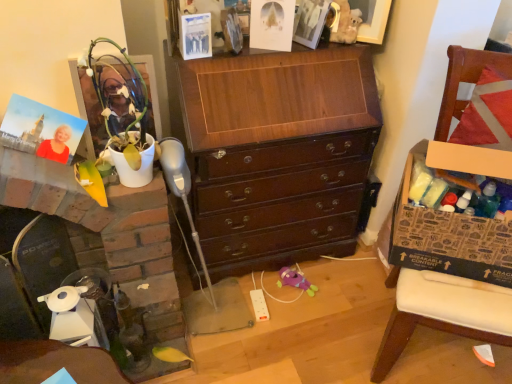
What do you see at coordinates (310, 22) in the screenshot?
I see `matte white picture frame at upper center, placed as the second picture frame when sorted from bottom to top` at bounding box center [310, 22].

Locate an element on the screen. matte plastic picture frame at upper left, which is the 2th picture frame from right to left is located at coordinates (151, 88).

In order to face matte plastic picture frame at upper left, the second picture frame viewed from the top, should I rotate leftwards or rightwards?

Rotate left and turn 17.131 degrees.

This screenshot has height=384, width=512. Find the location of `shiny dark wood chest of drawers at center`. shiny dark wood chest of drawers at center is located at coordinates (276, 152).

Measure the distance between brown wooden chair at right and camera.

A distance of 3.76 feet exists between brown wooden chair at right and camera.

The image size is (512, 384). I want to click on brown cardboard box at right, so click(x=453, y=221).

Based on the photo, which object is closer to the camera, matte white picture frame at upper center, arranged as the 2th picture frame when viewed from the front, or brown wooden chair at right?

brown wooden chair at right is closer to the camera.

Which of these two, matte white picture frame at upper center, placed as the second picture frame when sorted from bottom to top, or brown wooden chair at right, stands taller?

Standing taller between the two is brown wooden chair at right.

From the picture: From the image's perspective, which is above, matte white picture frame at upper center, arranged as the 2th picture frame when viewed from the front, or brown wooden chair at right?

matte white picture frame at upper center, arranged as the 2th picture frame when viewed from the front, from the image's perspective.

Does matte white picture frame at upper center, arranged as the 2th picture frame when viewed from the front, have a lesser height compared to brown cardboard box at right?

Yes.

From the image's perspective, is matte white picture frame at upper center, which is counted as the 1th picture frame, starting from the back, above or below brown cardboard box at right?

Clearly, from the image's perspective, matte white picture frame at upper center, which is counted as the 1th picture frame, starting from the back, is above brown cardboard box at right.

Are matte white picture frame at upper center, which appears as the first picture frame when viewed from the right, and brown cardboard box at right far apart?

matte white picture frame at upper center, which appears as the first picture frame when viewed from the right, is near brown cardboard box at right, not far away.

Which point is more distant from viewer, (295,23) or (478,243)?

Positioned behind is point (295,23).

Which is more to the right, white glossy fireplace at left or brown cardboard box at right?

brown cardboard box at right.

Can you tell me how much white glossy fireplace at left and brown cardboard box at right differ in facing direction?

The facing directions of white glossy fireplace at left and brown cardboard box at right are 33.1 degrees apart.

Is brown cardboard box at right a part of white glossy fireplace at left?

No.

From a real-world perspective, is white glossy fireplace at left over brown cardboard box at right?

No, from a real-world perspective, white glossy fireplace at left is not above brown cardboard box at right.

From a real-world perspective, which object stands above the other?

brown cardboard box at right is physically above.

Can you confirm if brown wooden chair at right is smaller than brown cardboard box at right?

No.

Which of these two, brown wooden chair at right or brown cardboard box at right, stands taller?

Standing taller between the two is brown wooden chair at right.

In the scene shown: Is the depth of shiny dark wood chest of drawers at center greater than that of brown wooden chair at right?

Yes, it is behind brown wooden chair at right.

Which object is positioned more to the left, shiny dark wood chest of drawers at center or brown wooden chair at right?

shiny dark wood chest of drawers at center.

What's the angular difference between shiny dark wood chest of drawers at center and brown wooden chair at right's facing directions?

They differ by 30.6 degrees in their facing directions.

Based on the photo, from the image's perspective, between shiny dark wood chest of drawers at center and brown wooden chair at right, who is located below?

brown wooden chair at right, from the image's perspective.

Where is `fireplace on the left of brown wooden chair at right`? fireplace on the left of brown wooden chair at right is located at coordinates (106, 230).

Is white glossy fireplace at left to the left or to the right of brown wooden chair at right in the image?

From the image, it's evident that white glossy fireplace at left is to the left of brown wooden chair at right.

Relative to brown wooden chair at right, is white glossy fireplace at left in front or behind?

white glossy fireplace at left is positioned farther from the viewer than brown wooden chair at right.

Could you tell me if matte plastic picture frame at upper left, marked as the 1th picture frame in a left-to-right arrangement, is facing brown cardboard box at right?

No, matte plastic picture frame at upper left, marked as the 1th picture frame in a left-to-right arrangement, is not facing towards brown cardboard box at right.

Identify the location of the 1st picture frame behind when counting from the brown cardboard box at right. Image resolution: width=512 pixels, height=384 pixels. (151, 88).

Can brown cardboard box at right be found inside matte plastic picture frame at upper left, which is the 2th picture frame from right to left?

No.

Does matte plastic picture frame at upper left, marked as the first picture frame in a front-to-back arrangement, have a smaller size compared to brown cardboard box at right?

Correct, matte plastic picture frame at upper left, marked as the first picture frame in a front-to-back arrangement, occupies less space than brown cardboard box at right.

I want to click on furniture on the right of matte white picture frame at upper center, placed as the second picture frame when sorted from bottom to top, so click(434, 327).

At what (x,y) coordinates should I click in order to perform the action: click on cabinetry in front of the matte white picture frame at upper center, arranged as the 2th picture frame when viewed from the left. Please return your answer as a coordinate pair (x, y). This screenshot has width=512, height=384. Looking at the image, I should click on (453, 221).

From the picture: Based on their spatial positions, is white glossy fireplace at left or shiny dark wood chest of drawers at center closer to matte white picture frame at upper center, which appears as the first picture frame when viewed from the right?

shiny dark wood chest of drawers at center is positioned closer to the anchor matte white picture frame at upper center, which appears as the first picture frame when viewed from the right.

Which object lies further to the anchor point shiny dark wood chest of drawers at center, matte plastic picture frame at upper left, the second picture frame viewed from the top, or white glossy fireplace at left?

Based on the image, matte plastic picture frame at upper left, the second picture frame viewed from the top, appears to be further to shiny dark wood chest of drawers at center.

Estimate the real-world distances between objects in this image. Which object is closer to white glossy fireplace at left, matte white picture frame at upper center, which appears as the first picture frame when viewed from the right, or matte plastic picture frame at upper left, positioned as the 1th picture frame in bottom-to-top order?

The object closer to white glossy fireplace at left is matte plastic picture frame at upper left, positioned as the 1th picture frame in bottom-to-top order.

Looking at the image, which one is located further to brown cardboard box at right, shiny dark wood chest of drawers at center or matte plastic picture frame at upper left, the second picture frame viewed from the top?

matte plastic picture frame at upper left, the second picture frame viewed from the top.

Considering their positions, is matte plastic picture frame at upper left, positioned as the 1th picture frame in bottom-to-top order, positioned closer to matte white picture frame at upper center, which appears as the first picture frame when viewed from the right, than brown wooden chair at right?

The object closer to matte white picture frame at upper center, which appears as the first picture frame when viewed from the right, is matte plastic picture frame at upper left, positioned as the 1th picture frame in bottom-to-top order.

From the image, which object appears to be farther from white glossy fireplace at left, brown wooden chair at right or matte plastic picture frame at upper left, marked as the 1th picture frame in a left-to-right arrangement?

brown wooden chair at right.

Looking at the image, which one is located further to brown cardboard box at right, white glossy fireplace at left or matte white picture frame at upper center, which appears as the first picture frame when viewed from the right?

white glossy fireplace at left is further to brown cardboard box at right.

Which object lies further to the anchor point brown wooden chair at right, white glossy fireplace at left or matte white picture frame at upper center, arranged as the 2th picture frame when viewed from the left?

white glossy fireplace at left is further to brown wooden chair at right.

At what (x,y) coordinates should I click in order to perform the action: click on chest of drawers between matte white picture frame at upper center, arranged as the 2th picture frame when viewed from the left, and brown cardboard box at right, in the vertical direction. Please return your answer as a coordinate pair (x, y). The image size is (512, 384). Looking at the image, I should click on (276, 152).

Find the location of a particular element. picture frame between matte plastic picture frame at upper left, which is the 2th picture frame from right to left, and brown wooden chair at right, in the horizontal direction is located at coordinates (310, 22).

You are a GUI agent. You are given a task and a screenshot of the screen. Output one action in this format:
    pyautogui.click(x=<x>, y=<y>)
    Task: Click on the chest of drawers between matte plastic picture frame at upper left, marked as the first picture frame in a front-to-back arrangement, and matte white picture frame at upper center, arranged as the 2th picture frame when viewed from the front
    
    Given the screenshot: What is the action you would take?
    pyautogui.click(x=276, y=152)

Identify the location of the chest of drawers located between white glossy fireplace at left and brown cardboard box at right in the left-right direction. (276, 152).